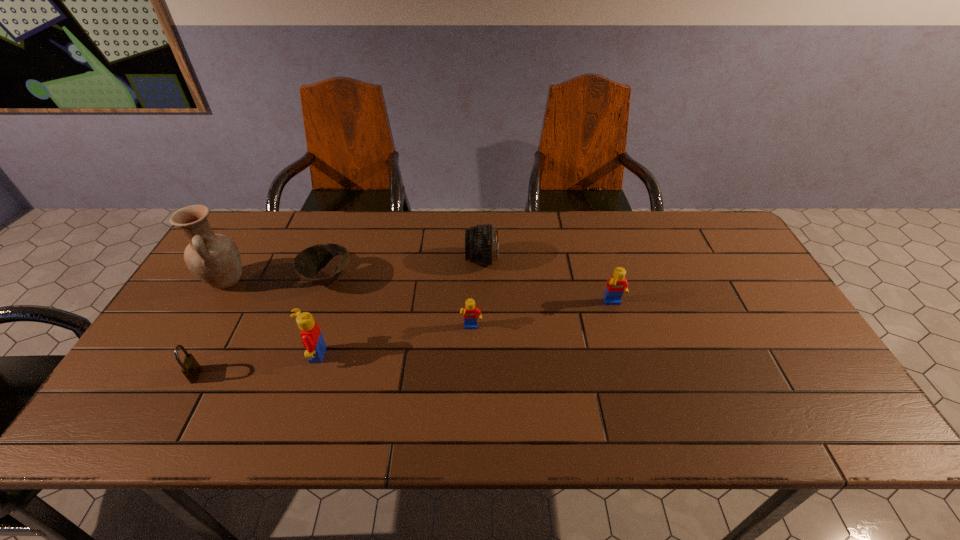
I want to click on free region that satisfies the following two spatial constraints: 1. on the front side of the padlock; 2. on the left side of the pottery, so click(171, 375).

The width and height of the screenshot is (960, 540). I want to click on vacant point that satisfies the following two spatial constraints: 1. on the face of the second tallest Lego; 2. on the face of the tallest Lego, so click(x=628, y=355).

At what (x,y) coordinates should I click in order to perform the action: click on vacant space that satisfies the following two spatial constraints: 1. on the face of the shortest Lego; 2. on the face of the nearest Lego. Please return your answer as a coordinate pair (x, y). Looking at the image, I should click on (470, 355).

Where is `free space that satisfies the following two spatial constraints: 1. at the front element of the telephoto lens; 2. on the front side of the padlock`? free space that satisfies the following two spatial constraints: 1. at the front element of the telephoto lens; 2. on the front side of the padlock is located at coordinates (482, 375).